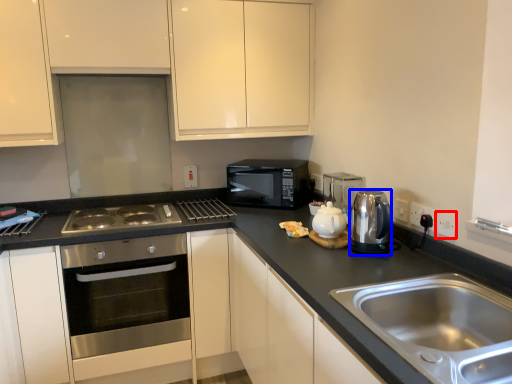
Question: Which object is closer to the camera taking this photo, electric outlet (highlighted by a red box) or appliance (highlighted by a blue box)?

Choices:
 (A) electric outlet
 (B) appliance

Answer: (B)